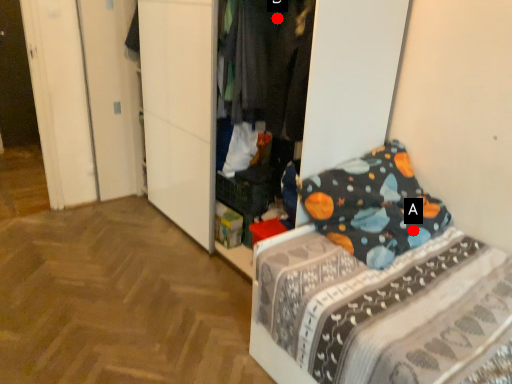
Question: Two points are circled on the image, labeled by A and B beside each circle. Which point is closer to the camera?

Choices:
 (A) A is closer
 (B) B is closer

Answer: (A)